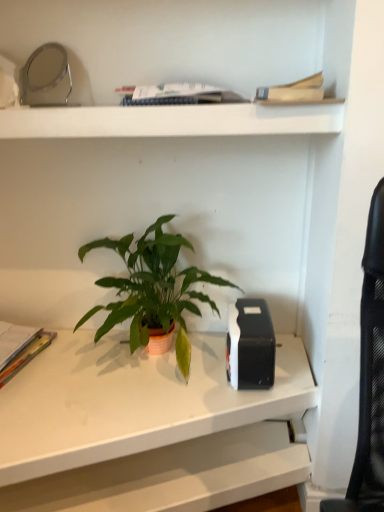
Identify the location of vacant space underneath green matte houseplant at center (from a real-world perspective). Image resolution: width=384 pixels, height=512 pixels. (150, 364).